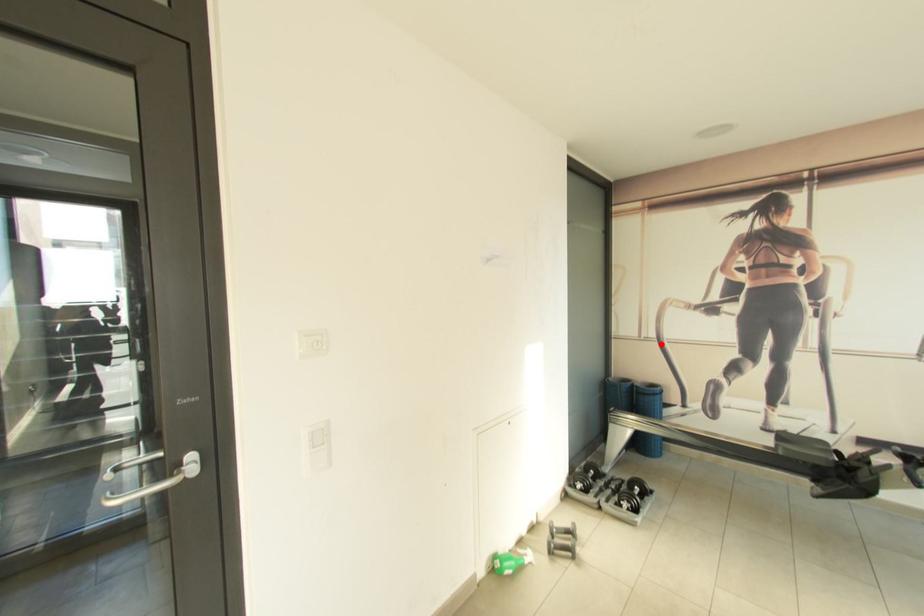
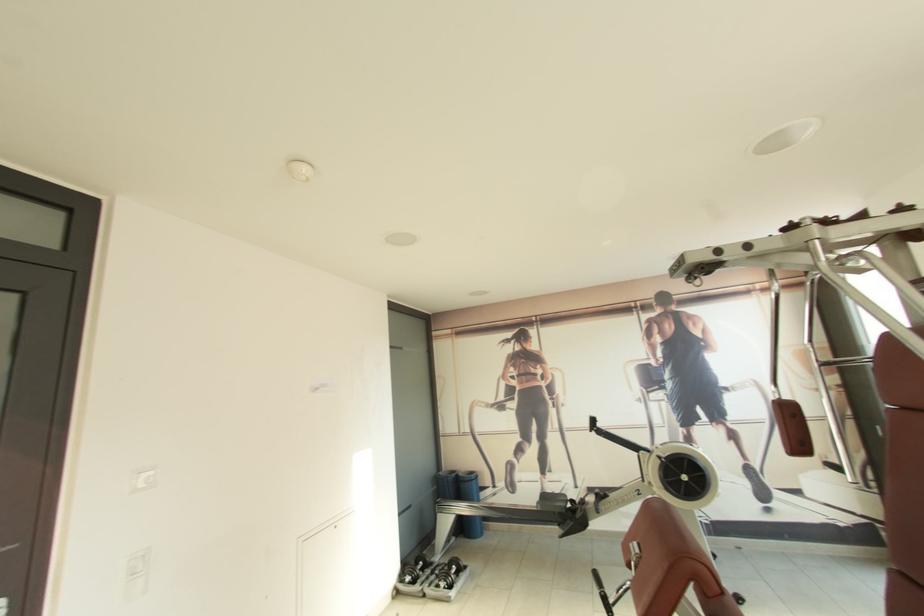
Locate, in the second image, the point that corresponds to the highlighted location in the first image.

(476, 438)